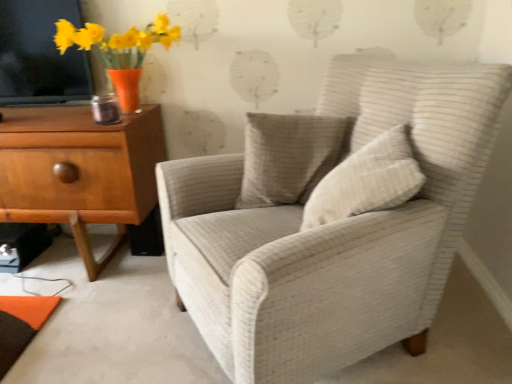
Question: Could you tell me if textured beige pillow at center, which is the 1th pillow from back to front, is facing beige textured pillow at center, which appears as the first pillow when viewed from the front?

Choices:
 (A) yes
 (B) no

Answer: (A)

Question: Is textured beige pillow at center, which ranks as the second pillow in front-to-back order, positioned in front of beige textured pillow at center, which ranks as the 2th pillow in back-to-front order?

Choices:
 (A) yes
 (B) no

Answer: (B)

Question: Considering the relative positions of textured beige pillow at center, which ranks as the second pillow in front-to-back order, and beige textured pillow at center, which ranks as the 2th pillow in back-to-front order, in the image provided, is textured beige pillow at center, which ranks as the second pillow in front-to-back order, to the left of beige textured pillow at center, which ranks as the 2th pillow in back-to-front order, from the viewer's perspective?

Choices:
 (A) no
 (B) yes

Answer: (B)

Question: From a real-world perspective, is textured beige pillow at center, which is the 1th pillow from back to front, located beneath beige textured pillow at center, which appears as the first pillow when viewed from the front?

Choices:
 (A) yes
 (B) no

Answer: (A)

Question: From a real-world perspective, is textured beige pillow at center, which is the 1th pillow from back to front, over beige textured pillow at center, which appears as the first pillow when viewed from the front?

Choices:
 (A) no
 (B) yes

Answer: (A)

Question: Would you say textured beige pillow at center, which is the 1th pillow from back to front, is to the left or to the right of white textured armchair at center in the picture?

Choices:
 (A) left
 (B) right

Answer: (A)

Question: Considering the positions of textured beige pillow at center, which ranks as the second pillow in front-to-back order, and white textured armchair at center in the image, is textured beige pillow at center, which ranks as the second pillow in front-to-back order, taller or shorter than white textured armchair at center?

Choices:
 (A) short
 (B) tall

Answer: (A)

Question: In the image, is textured beige pillow at center, which ranks as the second pillow in front-to-back order, positioned in front of or behind white textured armchair at center?

Choices:
 (A) behind
 (B) front

Answer: (A)

Question: Do you think textured beige pillow at center, which is the 1th pillow from back to front, is within white textured armchair at center, or outside of it?

Choices:
 (A) inside
 (B) outside

Answer: (A)

Question: Is light brown wood chest of drawers at left inside or outside of white textured armchair at center?

Choices:
 (A) outside
 (B) inside

Answer: (A)

Question: Is light brown wood chest of drawers at left wider or thinner than white textured armchair at center?

Choices:
 (A) thin
 (B) wide

Answer: (A)

Question: Considering the relative positions of light brown wood chest of drawers at left and white textured armchair at center in the image provided, is light brown wood chest of drawers at left to the left or to the right of white textured armchair at center?

Choices:
 (A) left
 (B) right

Answer: (A)

Question: From the image's perspective, relative to white textured armchair at center, is light brown wood chest of drawers at left above or below?

Choices:
 (A) below
 (B) above

Answer: (B)

Question: From the image's perspective, is matte orange vase with yellow flowers at upper left located above or below beige textured pillow at center, which ranks as the 2th pillow in back-to-front order?

Choices:
 (A) below
 (B) above

Answer: (B)

Question: From a real-world perspective, is matte orange vase with yellow flowers at upper left above or below beige textured pillow at center, which ranks as the 2th pillow in back-to-front order?

Choices:
 (A) below
 (B) above

Answer: (B)